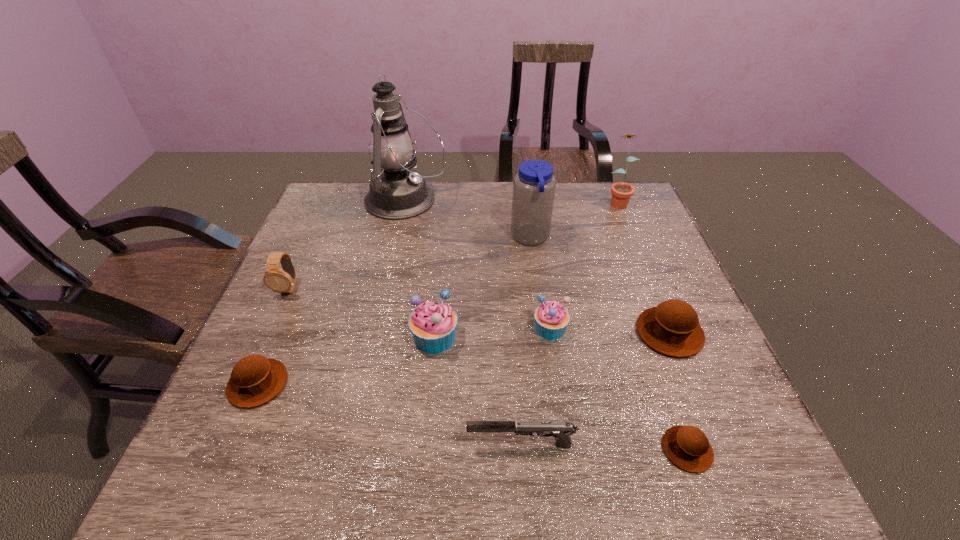
At what (x,y) coordinates should I click in order to perform the action: click on empty location between the gray gun and the fourth farthest object. Please return your answer as a coordinate pair (x, y). Image resolution: width=960 pixels, height=540 pixels. Looking at the image, I should click on (405, 366).

Image resolution: width=960 pixels, height=540 pixels. Identify the location of vacant area that lies between the farthest brown muffin and the water bottle. (600, 285).

You are a GUI agent. You are given a task and a screenshot of the screen. Output one action in this format:
    pyautogui.click(x=<x>, y=<y>)
    Task: Click on the free spot between the shortest object and the gray gun
    This screenshot has height=540, width=960.
    Given the screenshot: What is the action you would take?
    pyautogui.click(x=604, y=447)

You are a GUI agent. You are given a task and a screenshot of the screen. Output one action in this format:
    pyautogui.click(x=<x>, y=<y>)
    Task: Click on the free space that is in between the gun and the second muffin from left to right
    The height and width of the screenshot is (540, 960).
    Given the screenshot: What is the action you would take?
    pyautogui.click(x=478, y=391)

Where is `free space between the leftmost muffin and the gun`? The image size is (960, 540). free space between the leftmost muffin and the gun is located at coordinates (390, 414).

Locate an element on the screen. Image resolution: width=960 pixels, height=540 pixels. vacant space that is in between the water bottle and the oil lamp is located at coordinates pyautogui.click(x=468, y=219).

The width and height of the screenshot is (960, 540). I want to click on unoccupied position between the gray gun and the oil lamp, so click(464, 323).

Identify the location of unoccupied area between the gray gun and the left blue muffin. (478, 391).

This screenshot has width=960, height=540. I want to click on object that is the fourth closest one to the shortest object, so click(433, 324).

The width and height of the screenshot is (960, 540). I want to click on the fourth closest object relative to the oil lamp, so click(x=551, y=318).